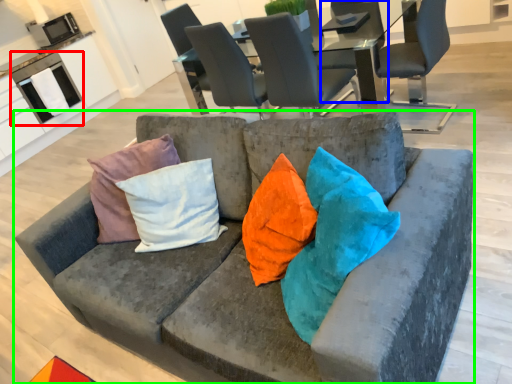
Question: Estimate the real-world distances between objects in this image. Which object is farther from appliance (highlighted by a red box), chair (highlighted by a blue box) or studio couch (highlighted by a green box)?

Choices:
 (A) chair
 (B) studio couch

Answer: (B)